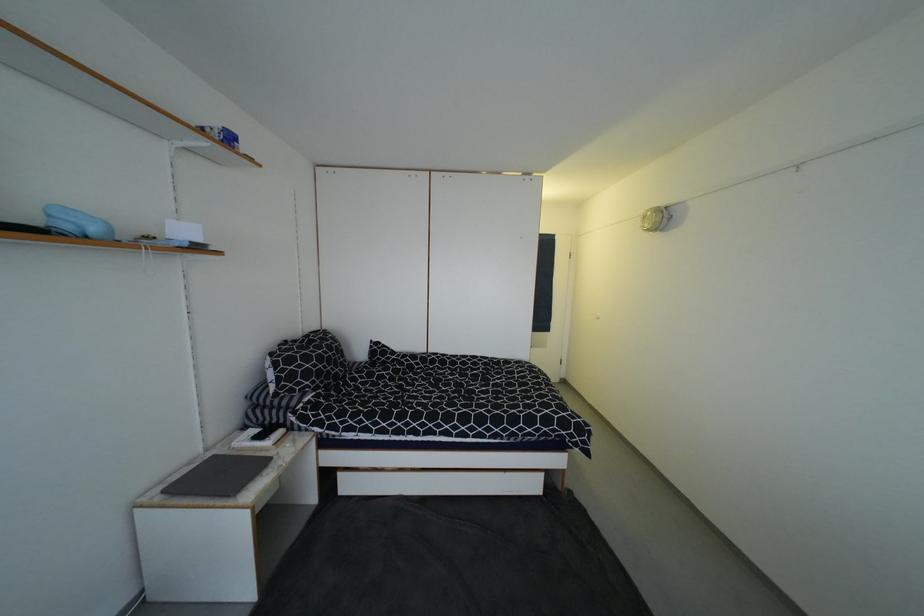
This screenshot has height=616, width=924. What do you see at coordinates (423, 419) in the screenshot?
I see `the white drawer handle` at bounding box center [423, 419].